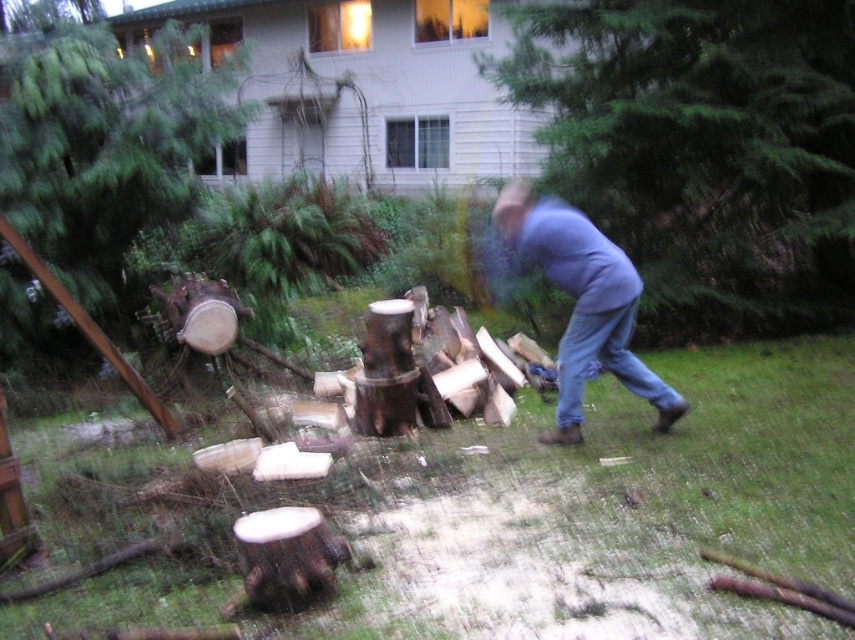
Question: In this image, where is green rough wood at center located relative to blue denim jeans at lower right?

Choices:
 (A) right
 (B) left

Answer: (A)

Question: Does green rough wood at center have a lesser width compared to blue denim jeans at lower right?

Choices:
 (A) no
 (B) yes

Answer: (A)

Question: Which of the following is the farthest from the observer?

Choices:
 (A) (658, 156)
 (B) (152, 86)

Answer: (A)

Question: Is green rough wood at center to the right of smooth brown stump at left from the viewer's perspective?

Choices:
 (A) no
 (B) yes

Answer: (B)

Question: Among these objects, which one is farthest from the camera?

Choices:
 (A) blue jeans at center
 (B) smooth brown stump at left
 (C) blue denim jeans at lower right

Answer: (B)

Question: Among these points, which one is nearest to the camera?

Choices:
 (A) (629, 372)
 (B) (588, 112)
 (C) (594, 340)
 (D) (18, 266)

Answer: (C)